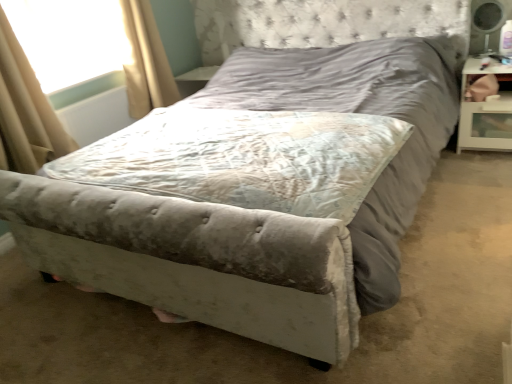
You are a GUI agent. You are given a task and a screenshot of the screen. Output one action in this format:
    pyautogui.click(x=<x>, y=<y>)
    Task: Click on the beige fabric curtain at upper left, positioned as the second curtain in front-to-back order
    This screenshot has width=512, height=384.
    Given the screenshot: What is the action you would take?
    pyautogui.click(x=145, y=61)

The height and width of the screenshot is (384, 512). What do you see at coordinates (244, 158) in the screenshot?
I see `velvet gray mattress at center` at bounding box center [244, 158].

Where is `beige fabric curtain at left, acting as the first curtain starting from the front`? beige fabric curtain at left, acting as the first curtain starting from the front is located at coordinates (25, 112).

Can you tell me how much velvet gray mattress at center and beige fabric curtain at left, which is counted as the second curtain, starting from the back, differ in facing direction?

They differ by 91.1 degrees in their facing directions.

Which point is more distant from viewer, (204, 162) or (9, 72)?

The point (9, 72) is behind.

Where is `mattress lying in front of the beige fabric curtain at left, placed as the second curtain when sorted from right to left`? The width and height of the screenshot is (512, 384). mattress lying in front of the beige fabric curtain at left, placed as the second curtain when sorted from right to left is located at coordinates (244, 158).

Are velvet gray mattress at center and beige fabric curtain at left, which is counted as the second curtain, starting from the back, located far from each other?

Actually, velvet gray mattress at center and beige fabric curtain at left, which is counted as the second curtain, starting from the back, are a little close together.

Does white glossy nightstand at right have a greater width compared to beige fabric curtain at upper left, the second curtain from the left?

Yes.

From a real-world perspective, is white glossy nightstand at right above or below beige fabric curtain at upper left, the second curtain from the left?

Clearly, from a real-world perspective, white glossy nightstand at right is below beige fabric curtain at upper left, the second curtain from the left.

Is white glossy nightstand at right at the right side of beige fabric curtain at upper left, the first curtain positioned from the right?

Indeed, white glossy nightstand at right is positioned on the right side of beige fabric curtain at upper left, the first curtain positioned from the right.

Find the location of a particular element. The height and width of the screenshot is (384, 512). curtain above the white glossy nightstand at right (from the image's perspective) is located at coordinates (145, 61).

From a real-world perspective, is white glossy nightstand at right positioned under beige fabric curtain at left, acting as the first curtain starting from the front, based on gravity?

Yes, from a real-world perspective, white glossy nightstand at right is below beige fabric curtain at left, acting as the first curtain starting from the front.

Based on the photo, from the image's perspective, which object appears higher, white glossy nightstand at right or beige fabric curtain at left, acting as the first curtain starting from the front?

white glossy nightstand at right is shown above in the image.

Considering the relative positions of white glossy nightstand at right and beige fabric curtain at left, which is counted as the second curtain, starting from the back, in the image provided, is white glossy nightstand at right behind beige fabric curtain at left, which is counted as the second curtain, starting from the back,?

Yes, white glossy nightstand at right is further from the viewer.

I want to click on curtain lying in front of the white glossy nightstand at right, so click(x=25, y=112).

Considering the relative sizes of velvet gray mattress at center and white glossy nightstand at right in the image provided, is velvet gray mattress at center shorter than white glossy nightstand at right?

Indeed, velvet gray mattress at center has a lesser height compared to white glossy nightstand at right.

Measure the distance between velvet gray mattress at center and white glossy nightstand at right.

They are 4.52 feet apart.

In terms of width, does velvet gray mattress at center look wider or thinner when compared to white glossy nightstand at right?

Considering their sizes, velvet gray mattress at center looks broader than white glossy nightstand at right.

In the image, is velvet gray mattress at center on the left side or the right side of white glossy nightstand at right?

velvet gray mattress at center is to the left of white glossy nightstand at right.

Between beige fabric curtain at left, acting as the first curtain starting from the front, and white glossy nightstand at right, which one has larger size?

Bigger between the two is beige fabric curtain at left, acting as the first curtain starting from the front.

From a real-world perspective, is beige fabric curtain at left, acting as the first curtain starting from the front, physically above white glossy nightstand at right?

→ Correct, in the physical world, beige fabric curtain at left, acting as the first curtain starting from the front, is higher than white glossy nightstand at right.

Consider the image. From the image's perspective, which object appears higher, beige fabric curtain at left, which is the 1th curtain in left-to-right order, or white glossy nightstand at right?

white glossy nightstand at right is shown above in the image.

Which is closer to the camera, (x=67, y=19) or (x=130, y=52)?

Point (x=67, y=19).

Based on the photo, are transparent plastic window screen at upper left and beige fabric curtain at upper left, the first curtain positioned from the right, located far from each other?

No.

Is transparent plastic window screen at upper left positioned with its back to beige fabric curtain at upper left, the 1th curtain positioned from the back?

No, transparent plastic window screen at upper left is not facing away from beige fabric curtain at upper left, the 1th curtain positioned from the back.

Which of these two, transparent plastic window screen at upper left or beige fabric curtain at upper left, positioned as the second curtain in front-to-back order, is bigger?

beige fabric curtain at upper left, positioned as the second curtain in front-to-back order.

Is beige fabric curtain at upper left, the 1th curtain positioned from the back, placed right next to velvet gray mattress at center?

They are not placed beside each other.

From the picture: Can you confirm if beige fabric curtain at upper left, the second curtain from the left, is thinner than velvet gray mattress at center?

Indeed, beige fabric curtain at upper left, the second curtain from the left, has a lesser width compared to velvet gray mattress at center.

From the image's perspective, would you say beige fabric curtain at upper left, the second curtain from the left, is positioned over velvet gray mattress at center?

Yes.

Can you confirm if beige fabric curtain at upper left, the 1th curtain positioned from the back, is positioned to the left of velvet gray mattress at center?

Yes.

I want to click on mattress in front of the beige fabric curtain at left, acting as the first curtain starting from the front, so click(x=244, y=158).

The image size is (512, 384). Identify the location of nightstand that appears on the right of beige fabric curtain at upper left, the second curtain from the left. (485, 113).

Looking at the image, which one is located closer to beige fabric curtain at left, which is the 1th curtain in left-to-right order, transparent plastic window screen at upper left or beige fabric curtain at upper left, positioned as the second curtain in front-to-back order?

Among the two, transparent plastic window screen at upper left is located nearer to beige fabric curtain at left, which is the 1th curtain in left-to-right order.

Estimate the real-world distances between objects in this image. Which object is closer to velvet gray mattress at center, beige fabric curtain at left, which is counted as the second curtain, starting from the back, or transparent plastic window screen at upper left?

beige fabric curtain at left, which is counted as the second curtain, starting from the back, lies closer to velvet gray mattress at center than the other object.

Estimate the real-world distances between objects in this image. Which object is further from white glossy nightstand at right, velvet gray mattress at center or beige fabric curtain at left, acting as the first curtain starting from the front?

Based on the image, beige fabric curtain at left, acting as the first curtain starting from the front, appears to be further to white glossy nightstand at right.

Considering their positions, is white glossy nightstand at right positioned further to beige fabric curtain at upper left, the first curtain positioned from the right, than velvet gray mattress at center?

white glossy nightstand at right is further to beige fabric curtain at upper left, the first curtain positioned from the right.

Looking at the image, which one is located further to beige fabric curtain at left, placed as the second curtain when sorted from right to left, beige fabric curtain at upper left, the first curtain positioned from the right, or velvet gray mattress at center?

Based on the image, velvet gray mattress at center appears to be further to beige fabric curtain at left, placed as the second curtain when sorted from right to left.

Consider the image. Based on their spatial positions, is white glossy nightstand at right or beige fabric curtain at upper left, the second curtain from the left, closer to beige fabric curtain at left, which is the 1th curtain in left-to-right order?

beige fabric curtain at upper left, the second curtain from the left.

Looking at the image, which one is located further to velvet gray mattress at center, beige fabric curtain at upper left, positioned as the second curtain in front-to-back order, or transparent plastic window screen at upper left?

Based on the image, transparent plastic window screen at upper left appears to be further to velvet gray mattress at center.

From the image, which object appears to be nearer to beige fabric curtain at left, which is the 1th curtain in left-to-right order, beige fabric curtain at upper left, the 1th curtain positioned from the back, or transparent plastic window screen at upper left?

transparent plastic window screen at upper left is positioned closer to the anchor beige fabric curtain at left, which is the 1th curtain in left-to-right order.

At what (x,y) coordinates should I click in order to perform the action: click on curtain between velvet gray mattress at center and beige fabric curtain at upper left, the second curtain from the left, from front to back. Please return your answer as a coordinate pair (x, y). Image resolution: width=512 pixels, height=384 pixels. Looking at the image, I should click on 25,112.

You are a GUI agent. You are given a task and a screenshot of the screen. Output one action in this format:
    pyautogui.click(x=<x>, y=<y>)
    Task: Click on the curtain between beige fabric curtain at left, acting as the first curtain starting from the front, and white glossy nightstand at right
    
    Given the screenshot: What is the action you would take?
    pyautogui.click(x=145, y=61)

Locate an element on the screen. The image size is (512, 384). mattress between beige fabric curtain at upper left, the 1th curtain positioned from the back, and white glossy nightstand at right is located at coordinates (244, 158).

Where is `mattress between beige fabric curtain at left, acting as the first curtain starting from the front, and white glossy nightstand at right, in the horizontal direction`? mattress between beige fabric curtain at left, acting as the first curtain starting from the front, and white glossy nightstand at right, in the horizontal direction is located at coordinates (244, 158).